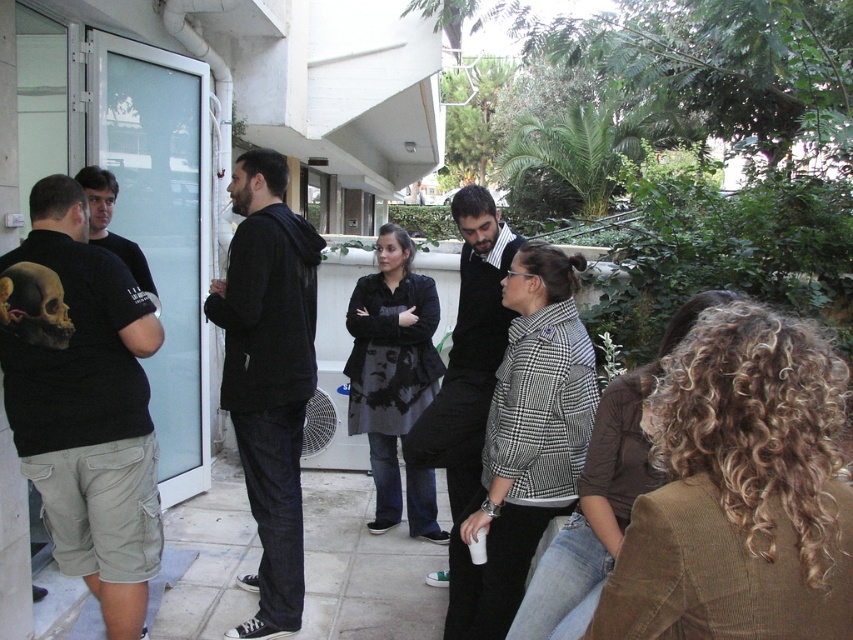
Between black cotton hoodie at center and black cotton shirt at center, which one has less height?

With less height is black cotton shirt at center.

Is point (230, 403) more distant than point (448, 593)?

No, it is not.

I want to click on black cotton hoodie at center, so click(268, 376).

Can you confirm if black matte t-shirt at left is shorter than black cotton shirt at center?

Correct, black matte t-shirt at left is not as tall as black cotton shirt at center.

At what (x,y) coordinates should I click in order to perform the action: click on black matte t-shirt at left. Please return your answer as a coordinate pair (x, y). Image resolution: width=853 pixels, height=640 pixels. Looking at the image, I should click on (83, 401).

I want to click on black matte t-shirt at left, so click(83, 401).

Can you confirm if black matte t-shirt at left is positioned above black cotton hoodie at center?

Actually, black matte t-shirt at left is below black cotton hoodie at center.

Can you confirm if black matte t-shirt at left is positioned below black cotton hoodie at center?

Correct, black matte t-shirt at left is located below black cotton hoodie at center.

Locate an element on the screen. black matte t-shirt at left is located at coordinates tap(83, 401).